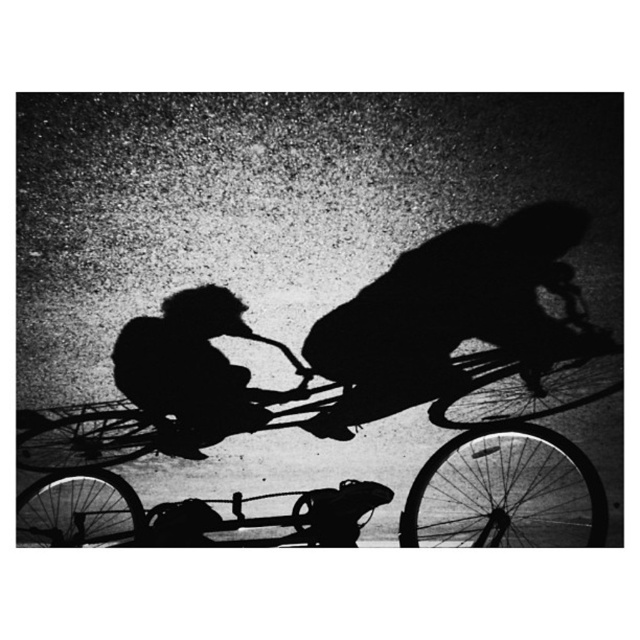
Question: Does black matte bicycle rider at center have a lesser width compared to silhouette cyclist at center?

Choices:
 (A) no
 (B) yes

Answer: (A)

Question: Which point appears closest to the camera in this image?

Choices:
 (A) (387, 369)
 (B) (134, 387)

Answer: (A)

Question: Considering the relative positions of black matte bicycle rider at center and silhouette cyclist at center in the image provided, where is black matte bicycle rider at center located with respect to silhouette cyclist at center?

Choices:
 (A) left
 (B) right

Answer: (B)

Question: Does black matte bicycle rider at center appear over silhouette cyclist at center?

Choices:
 (A) yes
 (B) no

Answer: (A)